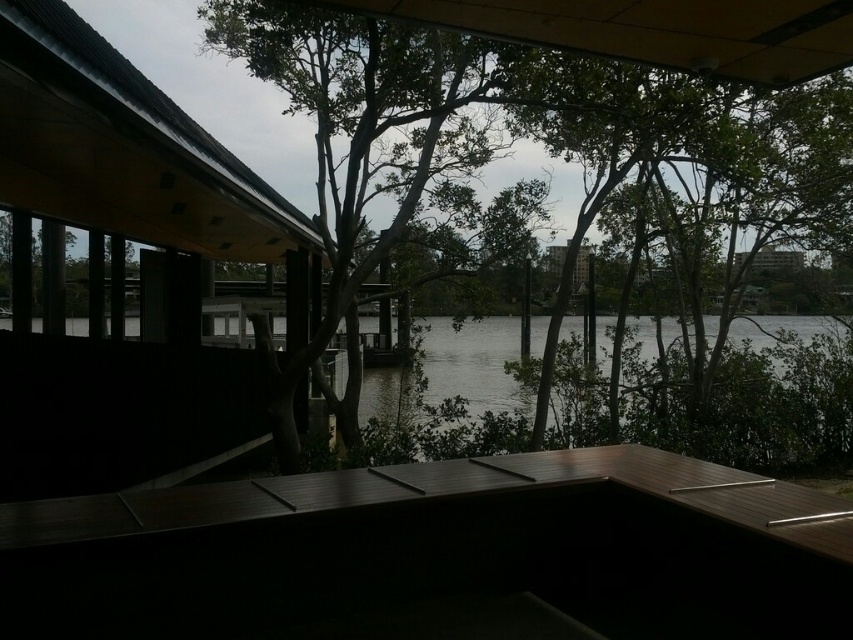
Question: Which is nearer to the dark wood deck at center?

Choices:
 (A) gray water at center
 (B) green leafy tree at center

Answer: (B)

Question: Which point is farther to the camera?

Choices:
 (A) (543, 339)
 (B) (248, 61)

Answer: (A)

Question: Which point appears farthest from the camera in this image?

Choices:
 (A) coord(341,323)
 (B) coord(695,460)

Answer: (A)

Question: Can you confirm if green leafy tree at center is positioned to the left of gray water at center?

Choices:
 (A) no
 (B) yes

Answer: (A)

Question: Is green leafy tree at center smaller than gray water at center?

Choices:
 (A) yes
 (B) no

Answer: (B)

Question: Is dark wood deck at center behind green leafy tree at center?

Choices:
 (A) no
 (B) yes

Answer: (A)